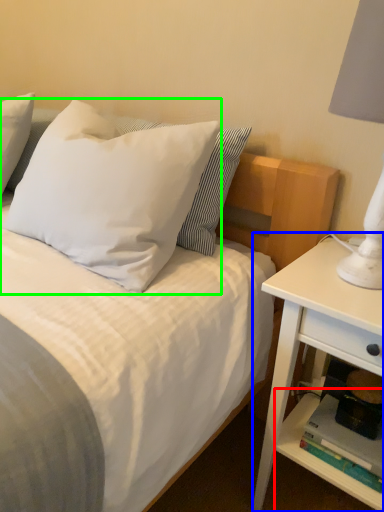
Question: Which is nearer to the shelf (highlighted by a red box)? nightstand (highlighted by a blue box) or pillow (highlighted by a green box).

Choices:
 (A) nightstand
 (B) pillow

Answer: (A)